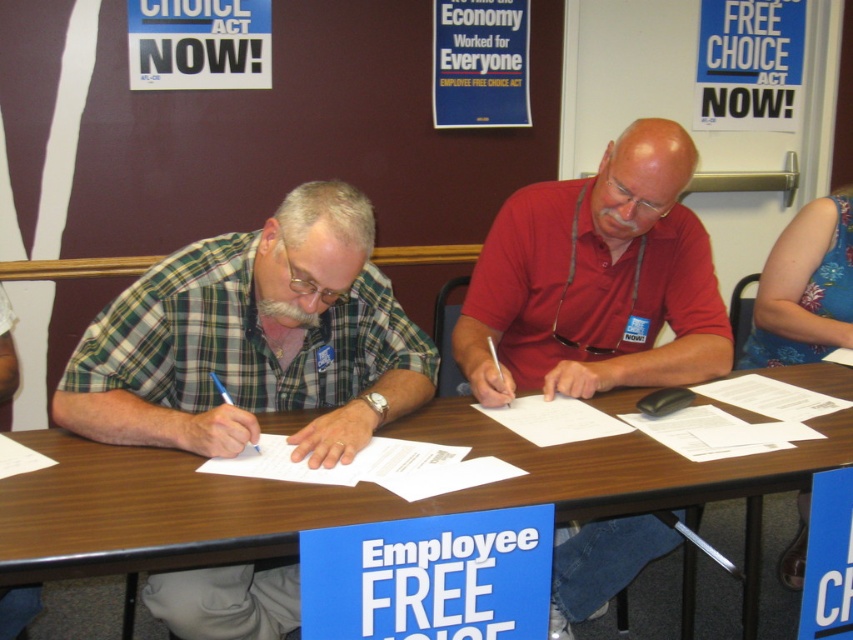
You are standing in front of the table and want to place a new document exactly where the matte red shirt at center is located. What are the coordinates where you should place the document?

The coordinates for the matte red shirt at center are at point (596, 280). Place the document there.

What is the significance of the point at coordinates (341, 493) in the image?

The point at coordinates (341, 493) marks the location of the brown wood table at center.